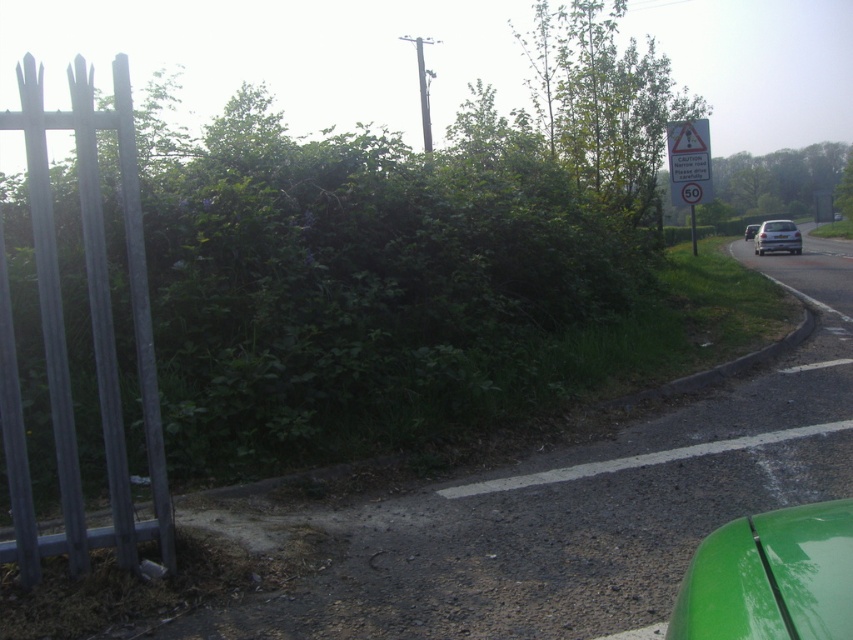
Question: Does green leafy hedge at left have a smaller size compared to matte silver van at right?

Choices:
 (A) yes
 (B) no

Answer: (B)

Question: Estimate the real-world distances between objects in this image. Which object is closer to the green leafy hedge at left?

Choices:
 (A) white glossy car at right
 (B) metallic gray fence at left
 (C) white plastic sign at upper right

Answer: (B)

Question: Which object is farther from the camera taking this photo?

Choices:
 (A) white plastic sign at upper right
 (B) white glossy car at right
 (C) matte silver van at right

Answer: (C)

Question: From the image, what is the correct spatial relationship of green leafy hedge at left in relation to white plastic sign at upper right?

Choices:
 (A) above
 (B) below

Answer: (B)

Question: Is metallic gray fence at left closer to the viewer compared to white glossy car at right?

Choices:
 (A) no
 (B) yes

Answer: (B)

Question: Which object is farther from the camera taking this photo?

Choices:
 (A) green glossy car at lower right
 (B) green leafy hedge at left

Answer: (B)